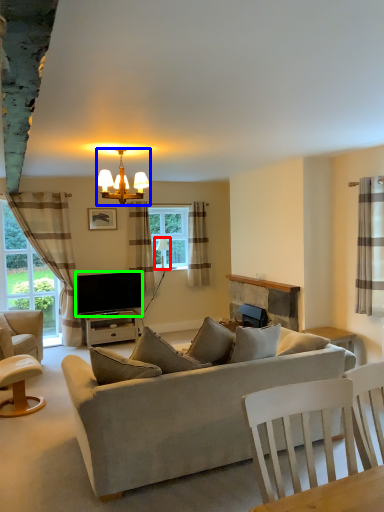
Question: Which is farther away from lamp (highlighted by a red box)? lamp (highlighted by a blue box) or television (highlighted by a green box)?

Choices:
 (A) lamp
 (B) television

Answer: (A)